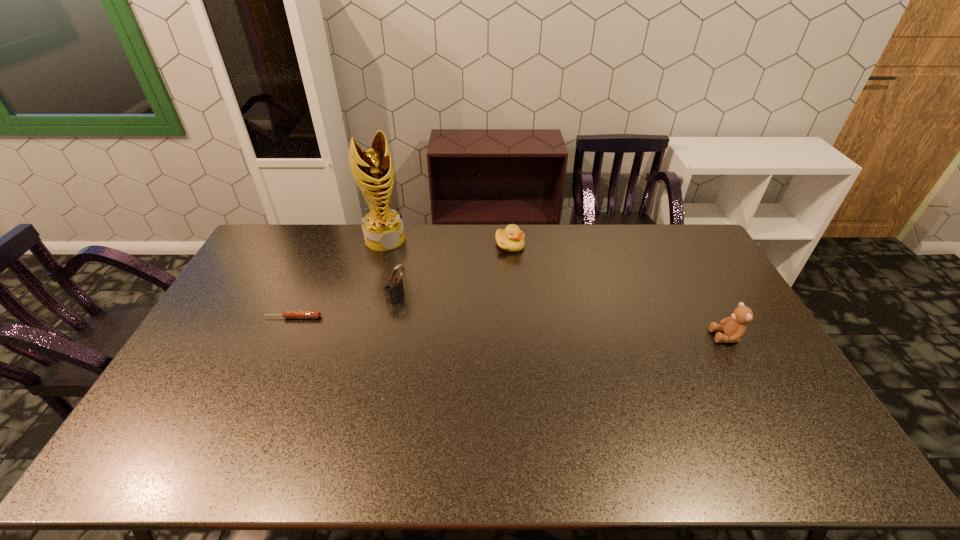
Locate an element on the screen. The height and width of the screenshot is (540, 960). vacant space located on the face of the rightmost object is located at coordinates (662, 336).

Where is `free space located 0.200m on the face of the rightmost object`? This screenshot has height=540, width=960. free space located 0.200m on the face of the rightmost object is located at coordinates (646, 336).

Where is `free region located with the keyhole on the front of the third nearest object`? free region located with the keyhole on the front of the third nearest object is located at coordinates (464, 334).

Where is `blank space located 0.130m with the keyhole on the front of the third nearest object`? This screenshot has width=960, height=540. blank space located 0.130m with the keyhole on the front of the third nearest object is located at coordinates (434, 318).

This screenshot has width=960, height=540. Identify the location of free point located with the keyhole on the front of the third nearest object. (427, 314).

This screenshot has width=960, height=540. I want to click on vacant space located 0.260m on the beak of the duckling, so click(542, 300).

In order to click on free space located 0.320m on the beak of the duckling in this screenshot , I will do `click(549, 312)`.

Locate an element on the screen. The width and height of the screenshot is (960, 540). free space located 0.080m on the beak of the duckling is located at coordinates (522, 267).

I want to click on free point located 0.240m on the front-facing side of the tallest object, so click(418, 287).

Identify the location of free location located 0.100m on the front-facing side of the tallest object. This screenshot has height=540, width=960. (402, 265).